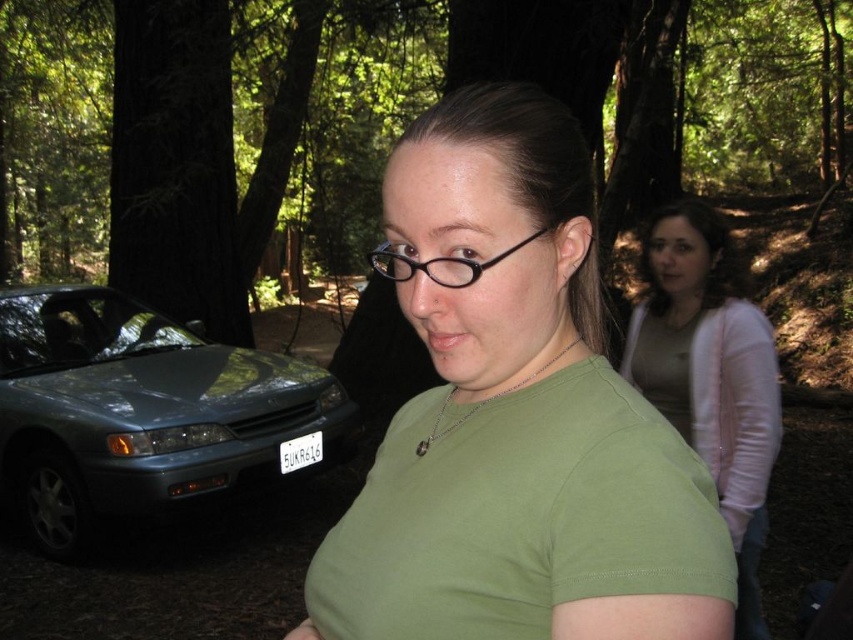
You are a photographer trying to capture the light pink sweater at upper right and the black plastic glasses at center in the same frame. Which object should you adjust your camera to focus on first if you want to include both in your shot?

The light pink sweater at upper right is positioned on the right side of black plastic glasses at center, so you should focus on the black plastic glasses at center first to ensure both objects are in frame.

You are a hiker who wants to take a photo of the metallic blue car at left and the light pink sweater at upper right. Which object should you focus on first if you want to capture both in a single frame without moving the camera?

The metallic blue car at left is positioned on the left side of light pink sweater at upper right, so you should focus on the metallic blue car at left first to ensure both objects are in the frame.